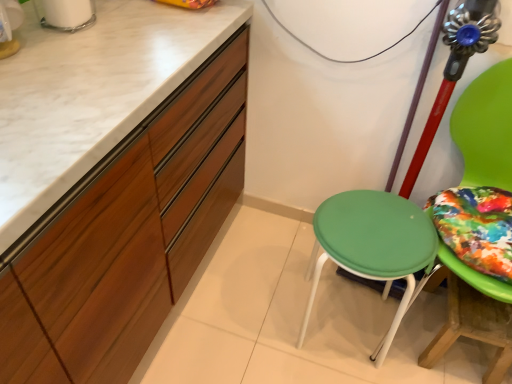
Where is `vacant space situated on the left part of green plastic stool at center`? vacant space situated on the left part of green plastic stool at center is located at coordinates (254, 309).